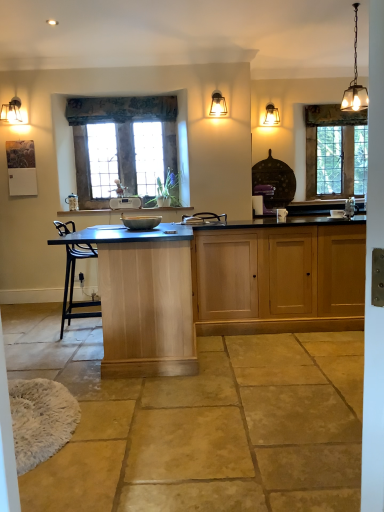
Find the location of a particular element. free space on the front side of light oak cabinet at center is located at coordinates (294, 356).